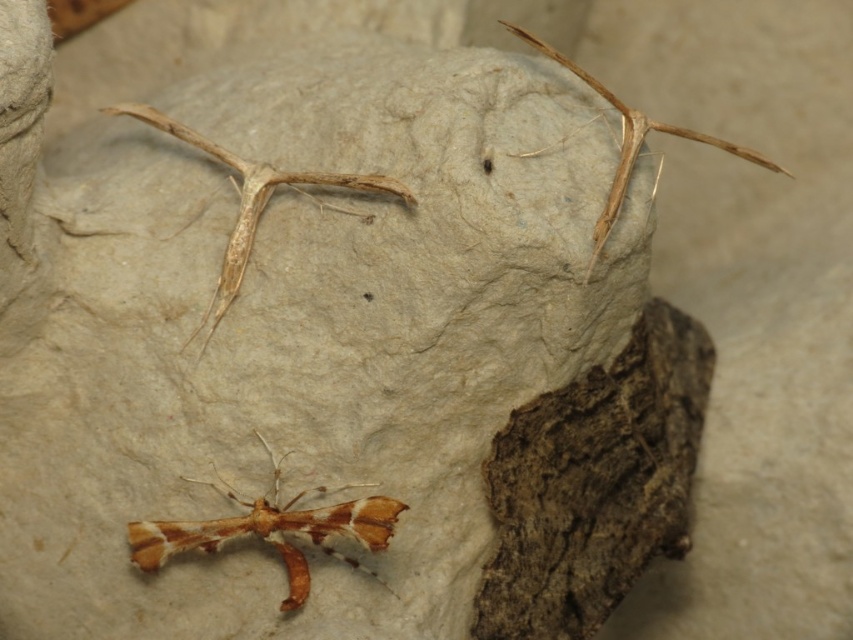
Does point (355, 515) lie in front of point (628, 124)?

That is True.

Can you confirm if brown papery moth at lower left is shorter than brown matte insect at upper right?

Yes.

Who is more distant from viewer, (230, 486) or (566, 60)?

The point (230, 486) is more distant.

Locate an element on the screen. The image size is (853, 640). brown papery moth at lower left is located at coordinates (273, 529).

Is brown papery moth at lower left positioned behind translucent beige moth at upper center?

That is False.

Describe the element at coordinates (273, 529) in the screenshot. The width and height of the screenshot is (853, 640). I see `brown papery moth at lower left` at that location.

Where is `brown papery moth at lower left`? The height and width of the screenshot is (640, 853). brown papery moth at lower left is located at coordinates (273, 529).

Which is more to the left, translucent beige moth at upper center or brown matte insect at upper right?

Positioned to the left is translucent beige moth at upper center.

Can you confirm if translucent beige moth at upper center is wider than brown matte insect at upper right?

Correct, the width of translucent beige moth at upper center exceeds that of brown matte insect at upper right.

Between point (302, 177) and point (637, 154), which one is positioned in front?

Point (637, 154) is in front.

Where is `translucent beige moth at upper center`? translucent beige moth at upper center is located at coordinates (252, 202).